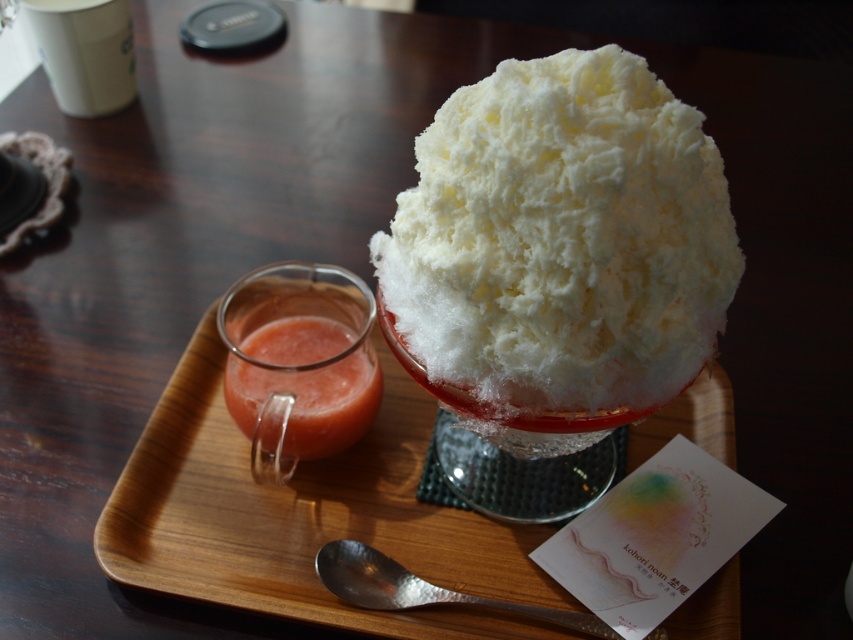
Question: Among these points, which one is farthest from the camera?

Choices:
 (A) (125, 84)
 (B) (334, 384)

Answer: (A)

Question: Which object is farther from the camera taking this photo?

Choices:
 (A) white fluffy shaved ice at center
 (B) white matte cup at upper left

Answer: (B)

Question: Which object appears closest to the camera in this image?

Choices:
 (A) translucent glass juice at upper left
 (B) white fluffy shaved ice at center
 (C) silver hammered spoon at lower center
 (D) white matte cup at upper left

Answer: (B)

Question: Can you confirm if white matte cup at upper left is thinner than silver hammered spoon at lower center?

Choices:
 (A) no
 (B) yes

Answer: (B)

Question: Is white fluffy shaved ice at center thinner than translucent glass juice at upper left?

Choices:
 (A) yes
 (B) no

Answer: (B)

Question: Can you confirm if white fluffy shaved ice at center is smaller than white matte cup at upper left?

Choices:
 (A) no
 (B) yes

Answer: (A)